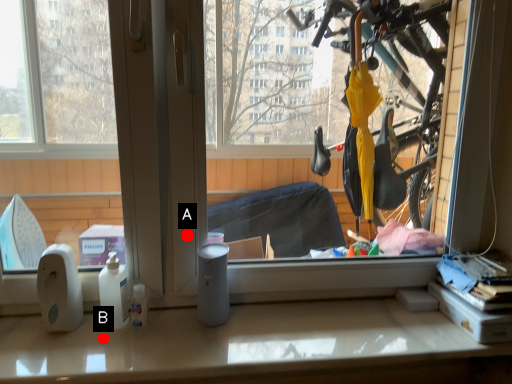
Question: Two points are circled on the image, labeled by A and B beside each circle. Which of the following is the farthest from the observer?

Choices:
 (A) A is further
 (B) B is further

Answer: (A)